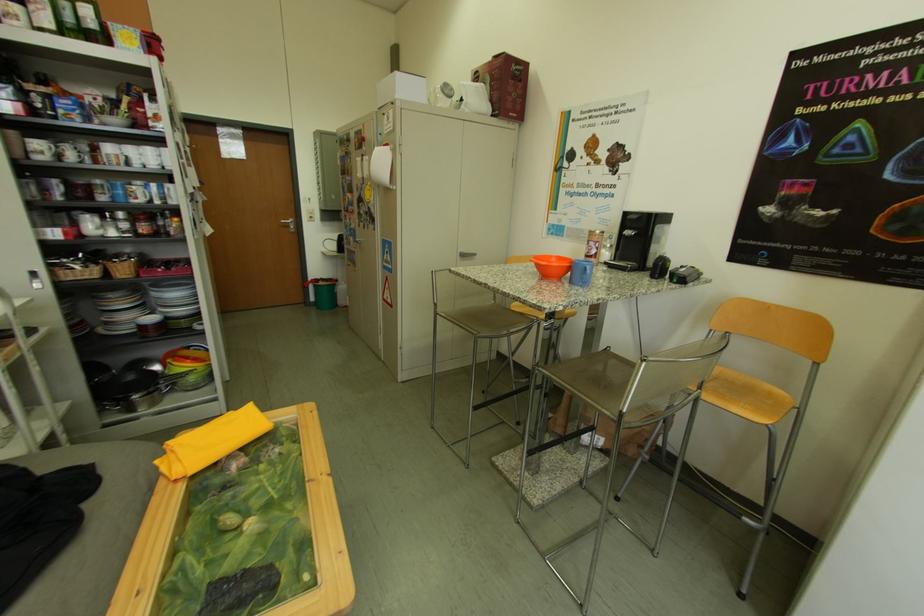
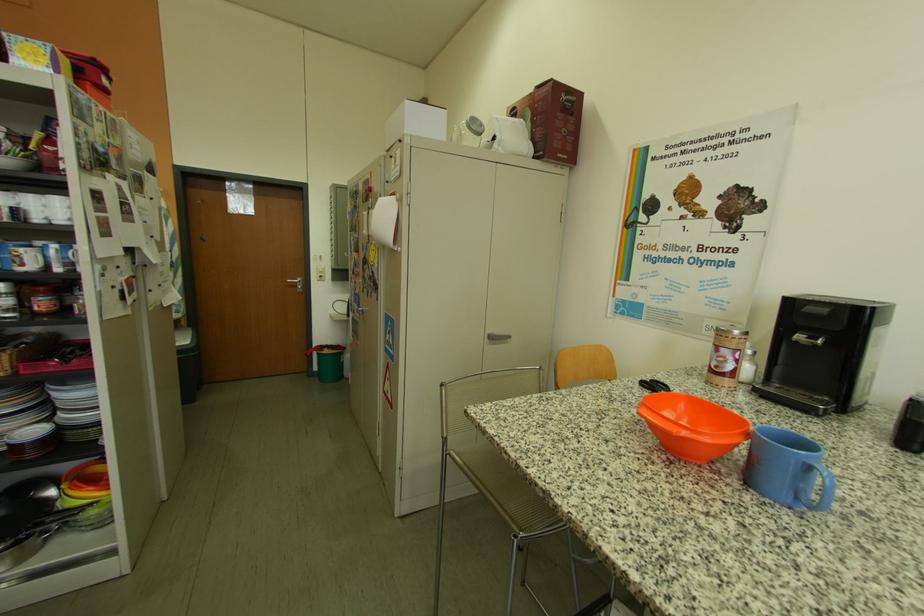
Find the pixel in the second image that matches point (565, 262) in the first image.

(695, 408)